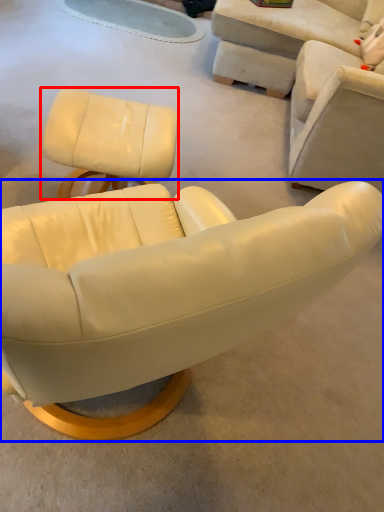
Question: Which of the following is the closest to the observer, chair (highlighted by a red box) or chair (highlighted by a blue box)?

Choices:
 (A) chair
 (B) chair

Answer: (B)